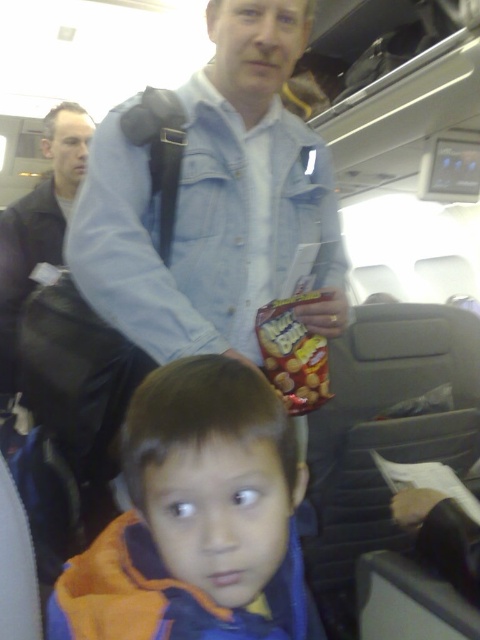
You are sitting in an airplane seat and notice a point at coordinate (214,202). What object is located at that point?

→ The point at coordinate (214,202) indicates the denim jacket at upper center.

You are a passenger seated in the airplane cabin and want to locate the denim jacket at upper center. Based on the coordinates provided, can you determine its exact location relative to the image frame?

The denim jacket at upper center is located at coordinates point (x=214, y=202) within the image frame.

You are seated in an airplane and want to reach for the matte plastic snack packet at center without disturbing the orange fleece jacket at lower left. Is the snack packet to your right or left side?

The matte plastic snack packet at center is to your right side because the orange fleece jacket at lower left is positioned to its left.